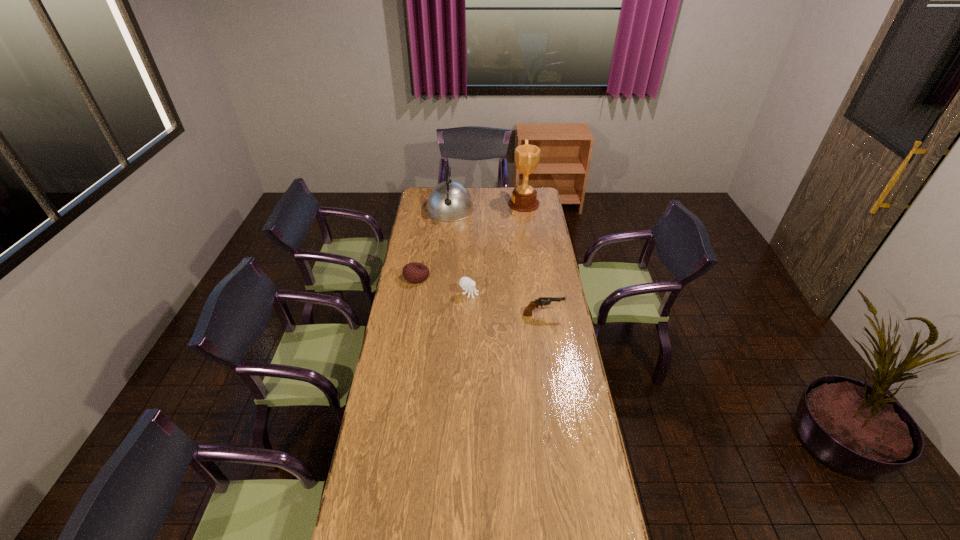
Where is `vacant region at the far edge of the desktop`? vacant region at the far edge of the desktop is located at coordinates (487, 187).

Image resolution: width=960 pixels, height=540 pixels. In the image, there is a desktop. Identify the location of vacant space at the left edge. (422, 225).

The height and width of the screenshot is (540, 960). What are the coordinates of `vacant space at the right edge of the desktop` in the screenshot? It's located at (529, 275).

I want to click on vacant space that's between the second nearest object and the second tallest object, so click(460, 252).

This screenshot has width=960, height=540. I want to click on vacant region between the beanbag and the award, so click(x=470, y=240).

Find the location of a particular element. free space between the nearest object and the beanbag is located at coordinates (480, 296).

Find the location of `empty space between the kettle and the gun`. empty space between the kettle and the gun is located at coordinates (496, 262).

You are a GUI agent. You are given a task and a screenshot of the screen. Output one action in this format:
    pyautogui.click(x=<x>, y=<y>)
    Task: Click on the free space between the shortest object and the tallest object
    Image resolution: width=960 pixels, height=540 pixels.
    Given the screenshot: What is the action you would take?
    tap(470, 240)

At what (x,y) coordinates should I click in order to perform the action: click on object that is the fourth closest to the second tallest object. Please return your answer as a coordinate pair (x, y). Looking at the image, I should click on (542, 301).

Identify which object is the fourth nearest to the third farthest object. Please provide its 2D coordinates. Your answer should be formatted as a tuple, i.e. [(x, y)], where the tuple contains the x and y coordinates of a point satisfying the conditions above.

[(524, 197)]